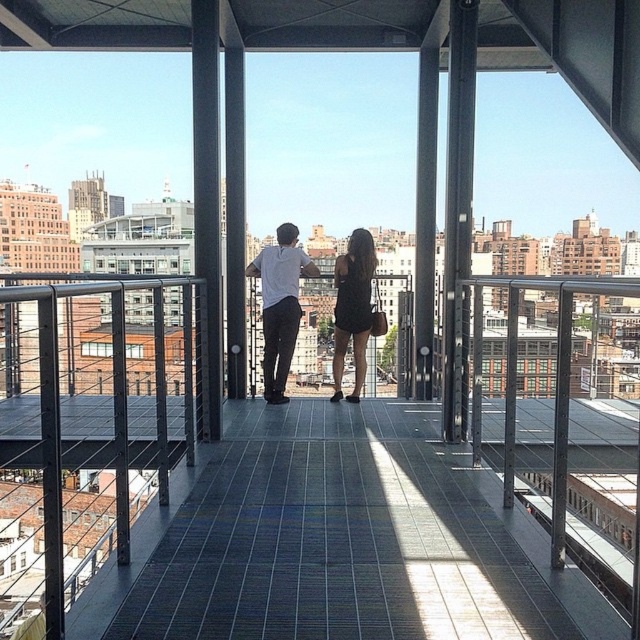
Can you confirm if metallic gray balcony at center is wider than white matte shirt at center?

Indeed, metallic gray balcony at center has a greater width compared to white matte shirt at center.

Is metallic gray balcony at center shorter than white matte shirt at center?

No, metallic gray balcony at center is not shorter than white matte shirt at center.

The image size is (640, 640). What do you see at coordinates (60, 406) in the screenshot?
I see `metallic gray balcony at center` at bounding box center [60, 406].

Locate an element on the screen. Image resolution: width=640 pixels, height=640 pixels. metallic gray balcony at center is located at coordinates (60, 406).

Which of these two, metallic gray balcony at center or black matte dress at center, stands shorter?

Standing shorter between the two is black matte dress at center.

Can you confirm if metallic gray balcony at center is positioned to the right of black matte dress at center?

Correct, you'll find metallic gray balcony at center to the right of black matte dress at center.

Who is more distant from viewer, (118,552) or (339,323)?

The point (339,323) is behind.

Find the location of a particular element. The height and width of the screenshot is (640, 640). metallic gray balcony at center is located at coordinates (60, 406).

Does point (266, 280) lie in front of point (348, 291)?

Yes, it is.

Can you confirm if white matte shirt at center is positioned above black matte dress at center?

Correct, white matte shirt at center is located above black matte dress at center.

Who is more forward, [269,280] or [332,396]?

Point [269,280] is in front.

At what (x,y) coordinates should I click in order to perform the action: click on white matte shirt at center. Please return your answer as a coordinate pair (x, y). Image resolution: width=640 pixels, height=640 pixels. Looking at the image, I should click on (280, 305).